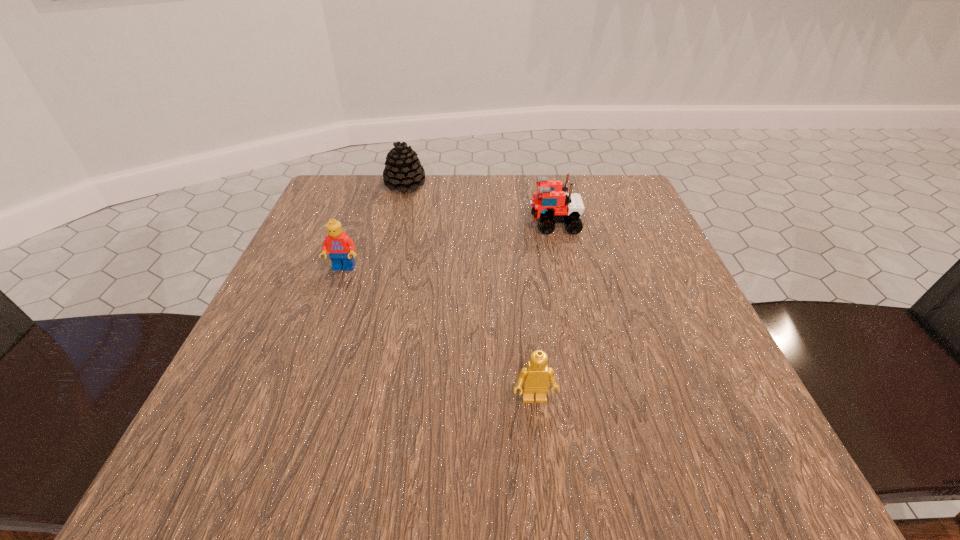
Find the location of a particular element. Image resolution: width=960 pixels, height=540 pixels. free space located 0.070m on the face of the nearest object is located at coordinates (540, 458).

Identify the location of pinecone at the far edge. The image size is (960, 540). (403, 170).

Find the location of `Lego present at the far edge`. Lego present at the far edge is located at coordinates (551, 204).

You are a GUI agent. You are given a task and a screenshot of the screen. Output one action in this format:
    pyautogui.click(x=<x>, y=<y>)
    Task: Click on the pinecone that is at the left edge
    The image size is (960, 540).
    Given the screenshot: What is the action you would take?
    (403, 170)

You are a GUI agent. You are given a task and a screenshot of the screen. Output one action in this format:
    pyautogui.click(x=<x>, y=<y>)
    Task: Click on the Lego that is at the left edge
    
    Given the screenshot: What is the action you would take?
    pyautogui.click(x=340, y=247)

Identify the location of object at the right edge. (551, 204).

At what (x,y) coordinates should I click in order to perform the action: click on object situated at the far left corner. Please return your answer as a coordinate pair (x, y). The height and width of the screenshot is (540, 960). Looking at the image, I should click on (403, 170).

Identify the location of object that is at the far right corner. The image size is (960, 540). (551, 204).

The width and height of the screenshot is (960, 540). In order to click on free region at the far edge of the desktop in this screenshot , I will do `click(555, 178)`.

In the image, there is a desktop. Where is `free space at the near edge`? free space at the near edge is located at coordinates (347, 469).